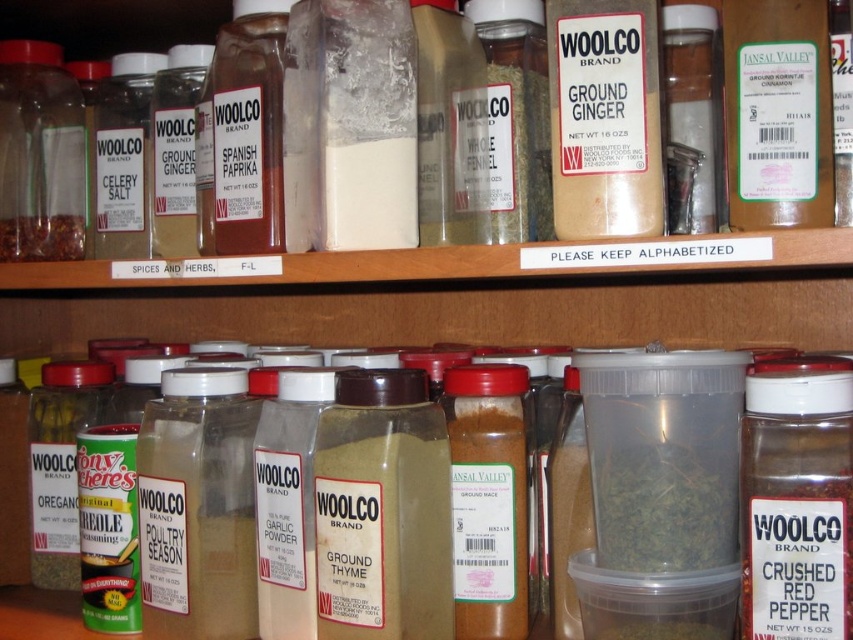
Can you confirm if clear plastic jar at center is thinner than brown powder spice at left?

In fact, clear plastic jar at center might be wider than brown powder spice at left.

Can you confirm if clear plastic jar at center is bigger than brown powder spice at left?

Correct, clear plastic jar at center is larger in size than brown powder spice at left.

This screenshot has width=853, height=640. In order to click on clear plastic jar at center in this screenshot , I will do `click(689, 116)`.

Image resolution: width=853 pixels, height=640 pixels. Find the location of `clear plastic jar at center`. clear plastic jar at center is located at coordinates (689, 116).

Who is positioned more to the right, matte plastic crushed red pepper at lower right or green herb at center?

matte plastic crushed red pepper at lower right is more to the right.

Between point (805, 589) and point (648, 518), which one is positioned in front?

Point (805, 589) is more forward.

From the picture: Who is more forward, (784, 605) or (734, 493)?

Point (784, 605)

Image resolution: width=853 pixels, height=640 pixels. I want to click on matte plastic crushed red pepper at lower right, so click(x=796, y=506).

Find the location of `matte glass jar at upper left`. matte glass jar at upper left is located at coordinates (39, 154).

In the scene shown: Between matte glass jar at upper left and brown powder spice at left, which one appears on the right side from the viewer's perspective?

Positioned to the right is brown powder spice at left.

Measure the distance between matte glass jar at upper left and camera.

The distance of matte glass jar at upper left from camera is 37.68 inches.

Identify the location of matte glass jar at upper left. (39, 154).